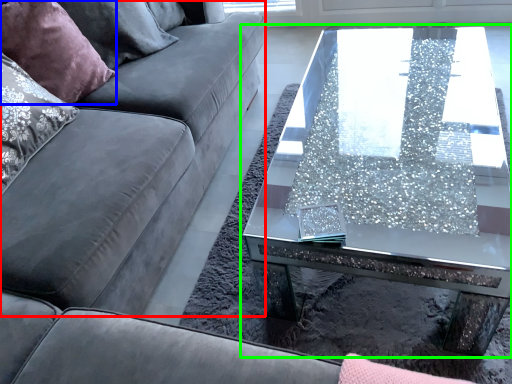
Question: Which is farther away from couch (highlighted by a red box)? pillow (highlighted by a blue box) or coffee table (highlighted by a green box)?

Choices:
 (A) pillow
 (B) coffee table

Answer: (B)